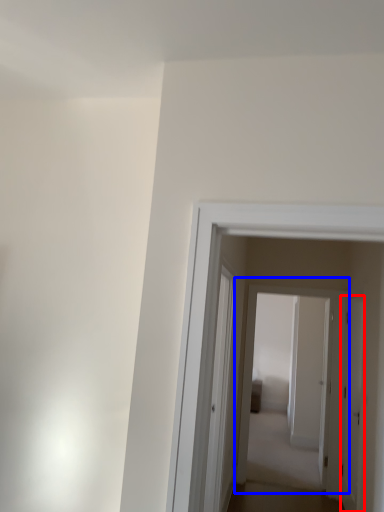
Question: Which object appears closest to the camera in this image, door (highlighted by a red box) or door (highlighted by a blue box)?

Choices:
 (A) door
 (B) door

Answer: (A)